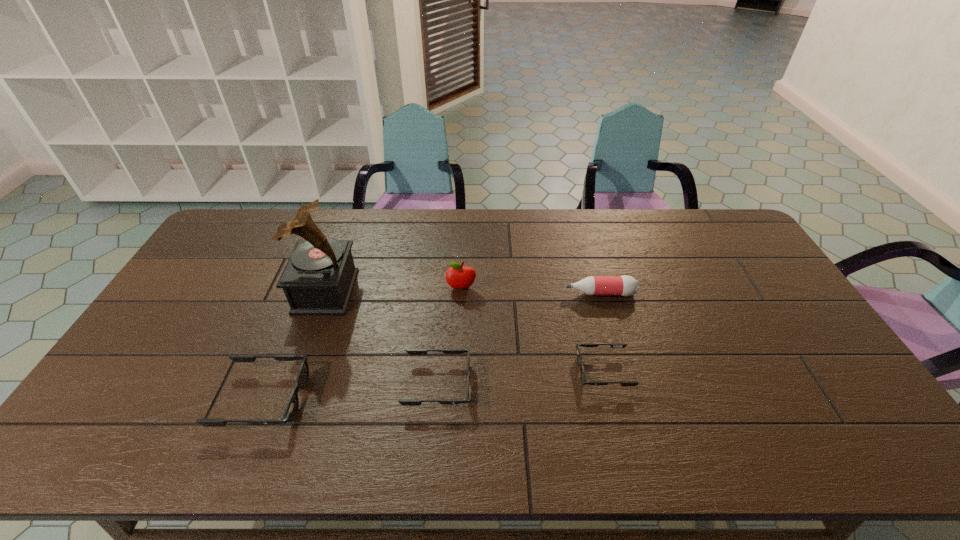
Where is `vacant place for an extra sunglasses on the right`? vacant place for an extra sunglasses on the right is located at coordinates (760, 358).